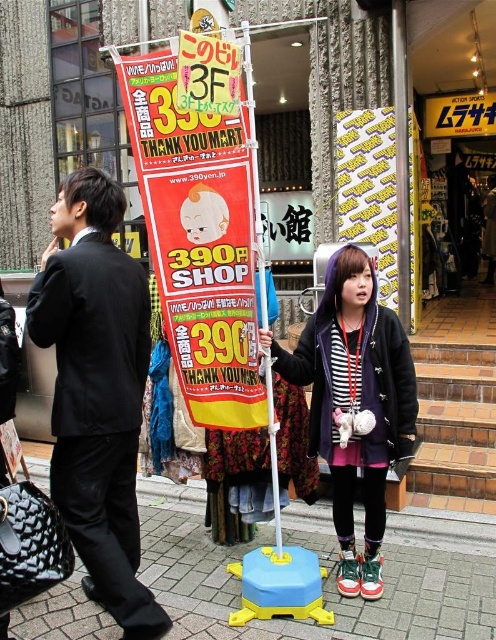
Is point (396, 524) in front of point (266, 576)?

No, it is not.

Is blue plastic base at lower center smaller than blue plastic toy at center?

No, blue plastic base at lower center is not smaller than blue plastic toy at center.

Who is more distant from viewer, (348,621) or (304,570)?

The point (304,570) is more distant.

You are a GUI agent. You are given a task and a screenshot of the screen. Output one action in this format:
    pyautogui.click(x=<x>, y=<y>)
    Task: Click on the blue plastic base at lower center
    
    Given the screenshot: What is the action you would take?
    pyautogui.click(x=323, y=580)

Is point (240, 292) farther from camera compared to point (300, 604)?

No.

Is yellow paper sign at center wider than yellow plastic sign at center?

Indeed, yellow paper sign at center has a greater width compared to yellow plastic sign at center.

The image size is (496, 640). I want to click on yellow paper sign at center, so click(x=197, y=240).

At what (x,y) coordinates should I click in order to perform the action: click on yellow paper sign at center. Please return your answer as a coordinate pair (x, y). Looking at the image, I should click on pyautogui.click(x=197, y=240).

Is blue plastic base at lower center further to camera compared to striped fabric hoodie at center?

That is False.

Which of these two, blue plastic base at lower center or striped fabric hoodie at center, stands shorter?

Standing shorter between the two is blue plastic base at lower center.

Identify the location of blue plastic base at lower center. This screenshot has width=496, height=640. (323, 580).